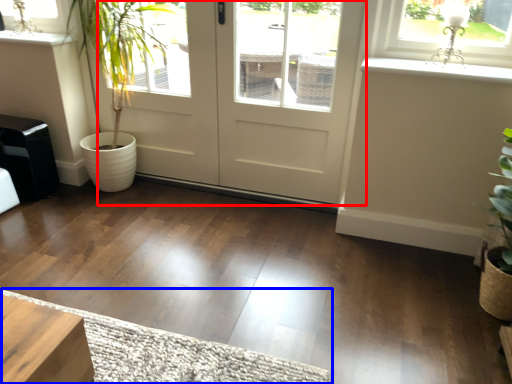
Question: Among these objects, which one is nearest to the camera, door (highlighted by a red box) or doormat (highlighted by a blue box)?

Choices:
 (A) door
 (B) doormat

Answer: (B)